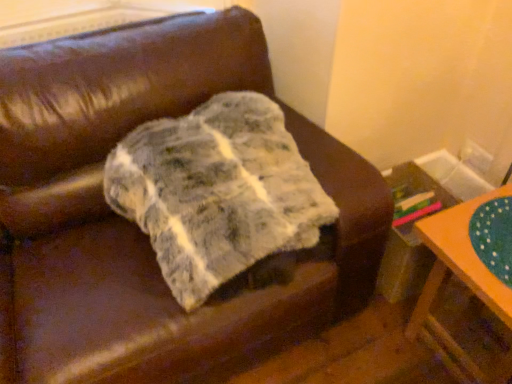
Question: Is marble-like fabric at center turned away from orange painted wood table at lower right?

Choices:
 (A) no
 (B) yes

Answer: (A)

Question: Does marble-like fabric at center appear on the right side of orange painted wood table at lower right?

Choices:
 (A) no
 (B) yes

Answer: (A)

Question: Does marble-like fabric at center lie behind orange painted wood table at lower right?

Choices:
 (A) no
 (B) yes

Answer: (A)

Question: Is marble-like fabric at center at the left side of orange painted wood table at lower right?

Choices:
 (A) yes
 (B) no

Answer: (A)

Question: Is marble-like fabric at center in contact with orange painted wood table at lower right?

Choices:
 (A) no
 (B) yes

Answer: (A)

Question: Considering the relative sizes of marble-like fabric at center and orange painted wood table at lower right in the image provided, is marble-like fabric at center taller than orange painted wood table at lower right?

Choices:
 (A) yes
 (B) no

Answer: (B)

Question: Is orange painted wood table at lower right aimed at marble-like fabric at center?

Choices:
 (A) no
 (B) yes

Answer: (A)

Question: From the image's perspective, is orange painted wood table at lower right over marble-like fabric at center?

Choices:
 (A) no
 (B) yes

Answer: (A)

Question: Considering the relative positions of orange painted wood table at lower right and marble-like fabric at center in the image provided, is orange painted wood table at lower right to the left of marble-like fabric at center from the viewer's perspective?

Choices:
 (A) no
 (B) yes

Answer: (A)

Question: Can you confirm if orange painted wood table at lower right is shorter than marble-like fabric at center?

Choices:
 (A) yes
 (B) no

Answer: (B)

Question: Is orange painted wood table at lower right turned away from marble-like fabric at center?

Choices:
 (A) yes
 (B) no

Answer: (B)

Question: Is marble-like fabric at center inside orange painted wood table at lower right?

Choices:
 (A) yes
 (B) no

Answer: (B)

Question: From a real-world perspective, is marble-like fabric at center above or below orange painted wood table at lower right?

Choices:
 (A) below
 (B) above

Answer: (B)